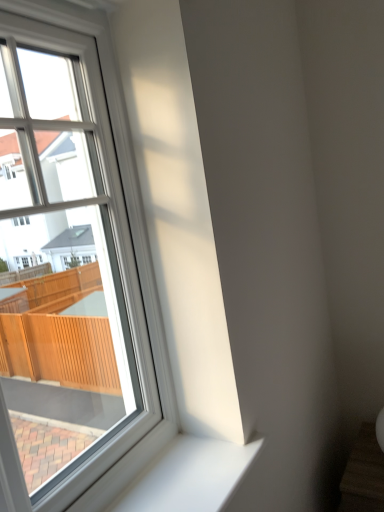
Question: From a real-world perspective, is white plastic window at upper left over white smooth window sill at lower left?

Choices:
 (A) no
 (B) yes

Answer: (B)

Question: Considering the relative sizes of white plastic window at upper left and white smooth window sill at lower left in the image provided, is white plastic window at upper left wider than white smooth window sill at lower left?

Choices:
 (A) no
 (B) yes

Answer: (A)

Question: Considering the relative positions of white plastic window at upper left and white smooth window sill at lower left in the image provided, is white plastic window at upper left in front of white smooth window sill at lower left?

Choices:
 (A) no
 (B) yes

Answer: (B)

Question: Could you tell me if white plastic window at upper left is facing white smooth window sill at lower left?

Choices:
 (A) no
 (B) yes

Answer: (B)

Question: Is white plastic window at upper left positioned far away from white smooth window sill at lower left?

Choices:
 (A) yes
 (B) no

Answer: (B)

Question: From a real-world perspective, is white plastic window at upper left positioned under white smooth window sill at lower left based on gravity?

Choices:
 (A) no
 (B) yes

Answer: (A)

Question: Can you confirm if white smooth window sill at lower left is smaller than white plastic window at upper left?

Choices:
 (A) no
 (B) yes

Answer: (B)

Question: Does white smooth window sill at lower left have a larger size compared to white plastic window at upper left?

Choices:
 (A) yes
 (B) no

Answer: (B)

Question: Does white smooth window sill at lower left appear on the left side of white plastic window at upper left?

Choices:
 (A) yes
 (B) no

Answer: (B)

Question: Is white smooth window sill at lower left wider than white plastic window at upper left?

Choices:
 (A) yes
 (B) no

Answer: (A)

Question: Can you confirm if white smooth window sill at lower left is thinner than white plastic window at upper left?

Choices:
 (A) no
 (B) yes

Answer: (A)

Question: Is white plastic window at upper left located within white smooth window sill at lower left?

Choices:
 (A) no
 (B) yes

Answer: (A)

Question: Considering the positions of white smooth window sill at lower left and white plastic window at upper left in the image, is white smooth window sill at lower left taller or shorter than white plastic window at upper left?

Choices:
 (A) tall
 (B) short

Answer: (B)